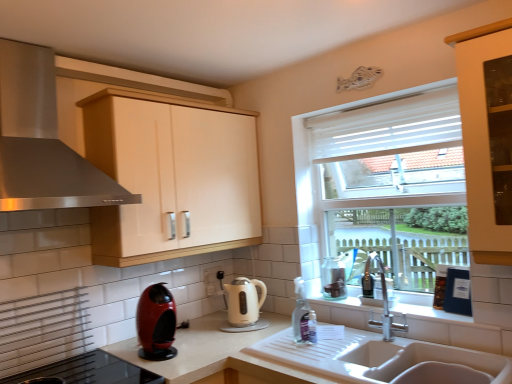
Question: From a real-world perspective, is stainless steel range hood at upper left beneath white glossy electric kettle at center, which is the second kitchen appliance from left to right?

Choices:
 (A) no
 (B) yes

Answer: (A)

Question: Is stainless steel range hood at upper left bigger than white glossy electric kettle at center, marked as the second kitchen appliance in a front-to-back arrangement?

Choices:
 (A) no
 (B) yes

Answer: (B)

Question: Is stainless steel range hood at upper left outside white glossy electric kettle at center, marked as the second kitchen appliance in a front-to-back arrangement?

Choices:
 (A) no
 (B) yes

Answer: (B)

Question: Does stainless steel range hood at upper left appear on the left side of white glossy electric kettle at center, the first kitchen appliance in the back-to-front sequence?

Choices:
 (A) no
 (B) yes

Answer: (B)

Question: Are stainless steel range hood at upper left and white glossy electric kettle at center, acting as the 1th kitchen appliance starting from the right, beside each other?

Choices:
 (A) yes
 (B) no

Answer: (B)

Question: Would you say white matte countertop at sink is inside or outside matte cream cabinet at upper center?

Choices:
 (A) inside
 (B) outside

Answer: (B)

Question: In terms of size, does white matte countertop at sink appear bigger or smaller than matte cream cabinet at upper center?

Choices:
 (A) big
 (B) small

Answer: (A)

Question: Relative to matte cream cabinet at upper center, is white matte countertop at sink in front or behind?

Choices:
 (A) behind
 (B) front

Answer: (B)

Question: Considering the relative positions of white matte countertop at sink and matte cream cabinet at upper center in the image provided, is white matte countertop at sink to the left or to the right of matte cream cabinet at upper center?

Choices:
 (A) left
 (B) right

Answer: (B)

Question: Based on their positions, is clear glass jar at right located to the left or right of white ceramic sink at lower center?

Choices:
 (A) right
 (B) left

Answer: (B)

Question: Do you think clear glass jar at right is within white ceramic sink at lower center, or outside of it?

Choices:
 (A) inside
 (B) outside

Answer: (B)

Question: Considering the positions of clear glass jar at right and white ceramic sink at lower center in the image, is clear glass jar at right bigger or smaller than white ceramic sink at lower center?

Choices:
 (A) big
 (B) small

Answer: (B)

Question: Is clear glass jar at right taller or shorter than white ceramic sink at lower center?

Choices:
 (A) tall
 (B) short

Answer: (A)

Question: Relative to white ceramic sink at lower center, is shiny red coffee machine at lower left, positioned as the 1th kitchen appliance in left-to-right order, in front or behind?

Choices:
 (A) behind
 (B) front

Answer: (A)

Question: Do you think shiny red coffee machine at lower left, arranged as the 1th kitchen appliance when viewed from the front, is within white ceramic sink at lower center, or outside of it?

Choices:
 (A) outside
 (B) inside

Answer: (A)